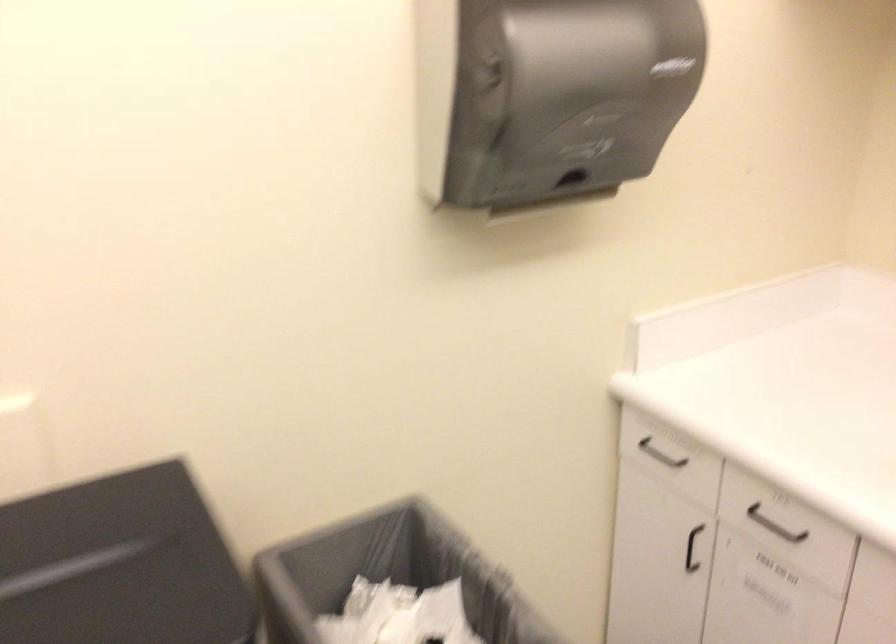
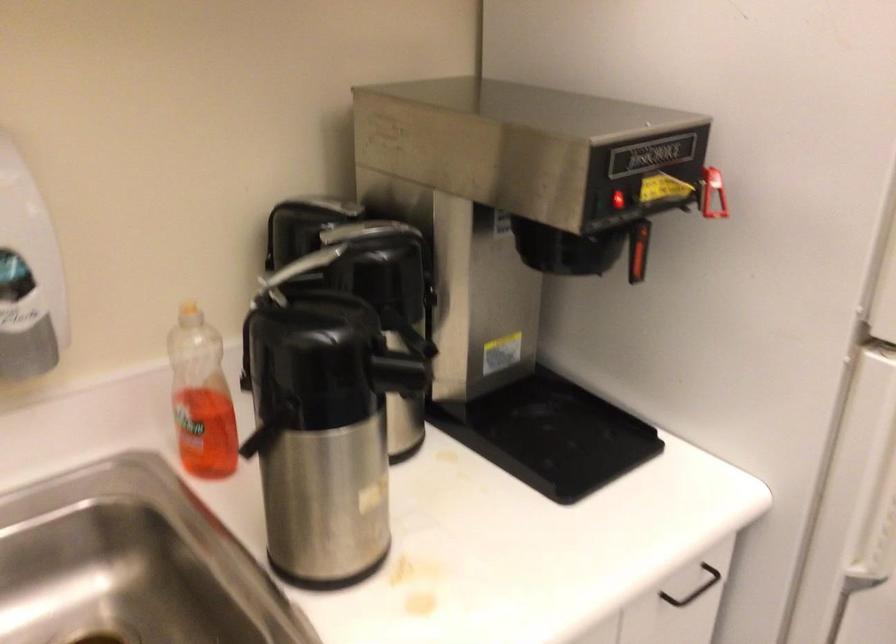
The images are taken continuously from a first-person perspective. In which direction is your viewpoint rotating?

The camera rotated toward right-down.